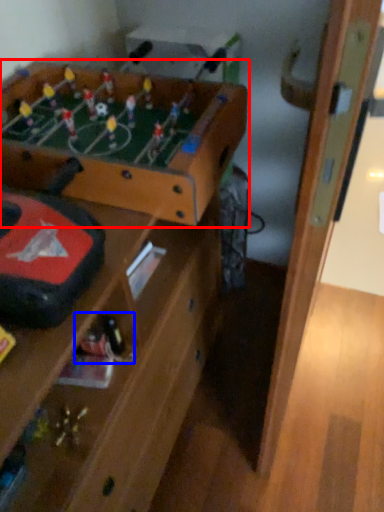
Question: Which object appears closest to the camera in this image, table (highlighted by a red box) or toy (highlighted by a blue box)?

Choices:
 (A) table
 (B) toy

Answer: (A)